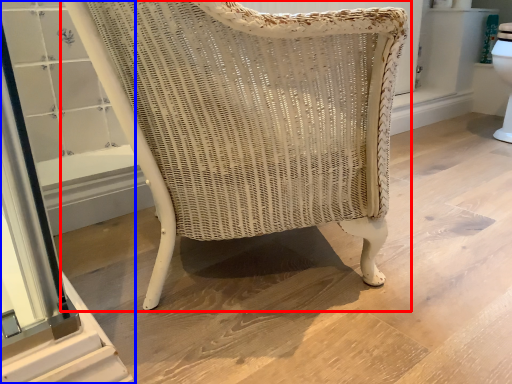
Question: Which object is closer to the camera taking this photo, chair (highlighted by a red box) or screen door (highlighted by a blue box)?

Choices:
 (A) chair
 (B) screen door

Answer: (A)